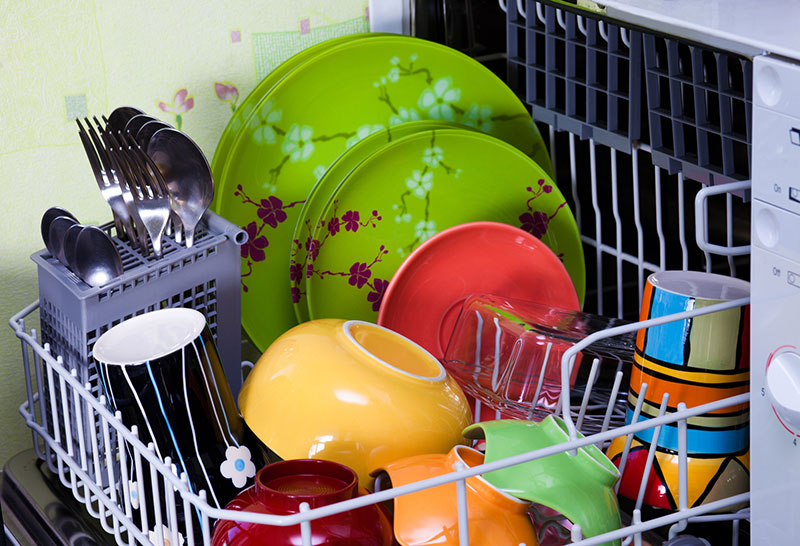
Locate an element on the screen. plastic coasted dividers along back of bottom rack of dishwasher is located at coordinates (552, 133), (568, 151), (588, 169), (608, 189), (634, 199), (658, 204), (676, 206), (708, 260), (730, 268).